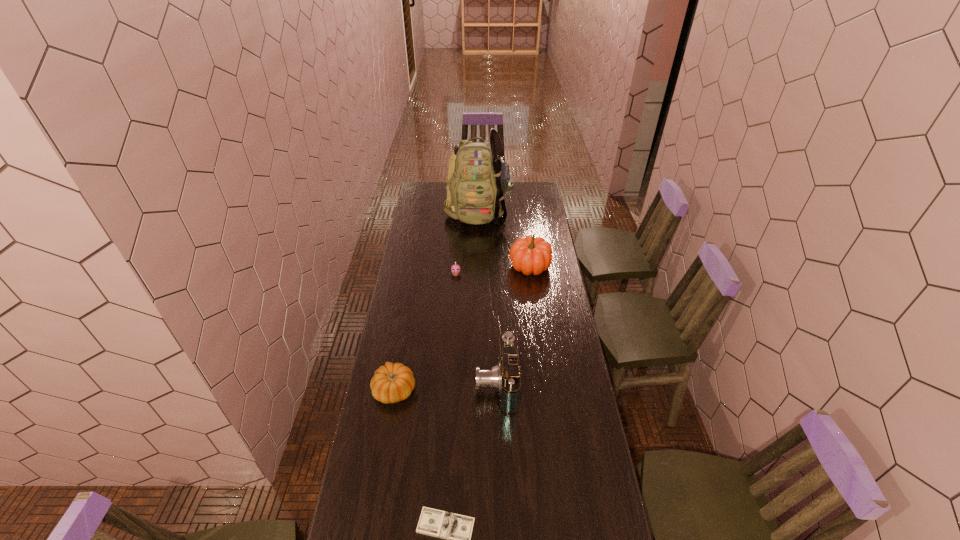
The image size is (960, 540). I want to click on unoccupied area between the fifth shortest object and the fourth shortest object, so click(x=513, y=325).

Locate an element on the screen. free spot between the fourth tallest object and the tallest object is located at coordinates (437, 301).

You are a GUI agent. You are given a task and a screenshot of the screen. Output one action in this format:
    pyautogui.click(x=<x>, y=<y>)
    Task: Click on the vacant point located between the third shortest object and the second tallest object
    The image size is (960, 540).
    Given the screenshot: What is the action you would take?
    pyautogui.click(x=463, y=328)

Locate an element on the screen. the closest object to the third tallest object is located at coordinates (393, 382).

Identify the location of object identified as the fifth closest to the camcorder. (478, 178).

You are a GUI agent. You are given a task and a screenshot of the screen. Output one action in this format:
    pyautogui.click(x=<x>, y=<y>)
    Task: Click on the free space that satisfies the following two spatial constraints: 1. on the back side of the third shortest object; 2. on the left side of the fifth shortest object
    The height and width of the screenshot is (540, 960).
    Given the screenshot: What is the action you would take?
    pyautogui.click(x=416, y=266)